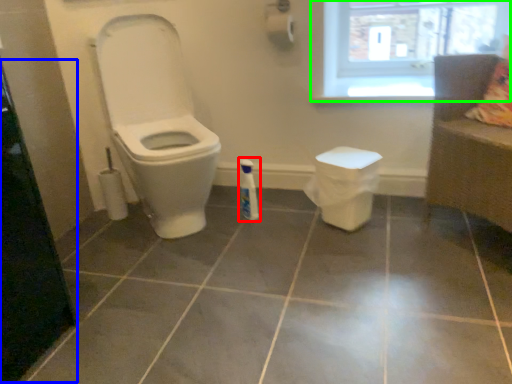
Question: Which object is positioned closest to cleaning product (highlighted by a red box)? Select from screen door (highlighted by a blue box) and window (highlighted by a green box).

Choices:
 (A) screen door
 (B) window

Answer: (B)